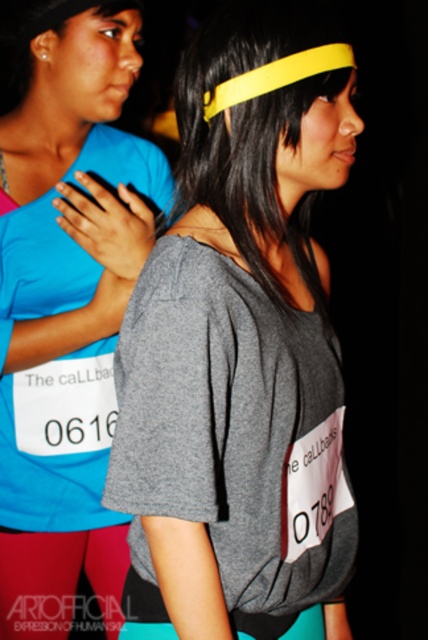
Which of these two, gray matte t-shirt at center or matte blue shirt at left, stands shorter?

gray matte t-shirt at center is shorter.

The image size is (428, 640). Identify the location of gray matte t-shirt at center. (240, 342).

Who is shorter, gray matte t-shirt at center or matte pink leggings at lower left?

Standing shorter between the two is matte pink leggings at lower left.

Find the location of a particular element. The width and height of the screenshot is (428, 640). gray matte t-shirt at center is located at coordinates (240, 342).

Does point (55, 52) lie in front of point (53, 628)?

Yes.

Does point (47, 92) come behind point (109, 547)?

No, it is in front of (109, 547).

Image resolution: width=428 pixels, height=640 pixels. I want to click on matte blue shirt at left, so click(x=65, y=300).

You are a GUI agent. You are given a task and a screenshot of the screen. Output one action in this format:
    pyautogui.click(x=<x>, y=<y>)
    Task: Click on the matte blue shirt at left
    
    Given the screenshot: What is the action you would take?
    pyautogui.click(x=65, y=300)